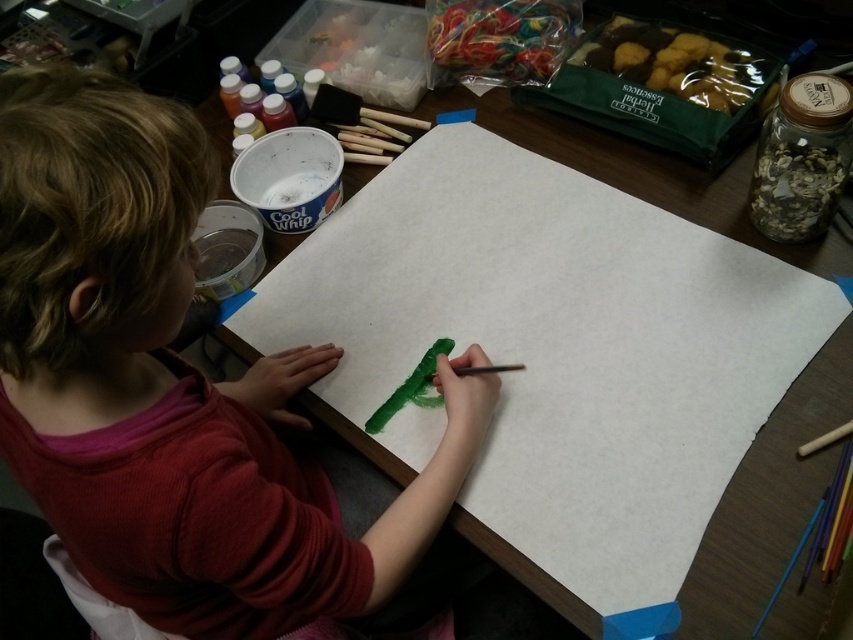
Question: Does multicolored plastic paintbrush at lower right appear on the left side of green matte paint brush at center?

Choices:
 (A) yes
 (B) no

Answer: (B)

Question: Does white paper at center appear on the left side of multicolored plastic paintbrush at lower right?

Choices:
 (A) yes
 (B) no

Answer: (A)

Question: Which is nearer to the green matte paint brush at center?

Choices:
 (A) white paper at center
 (B) smooth red shirt at center
 (C) multicolored plastic paintbrush at lower right

Answer: (A)

Question: Is multicolored plastic paintbrush at lower right behind green matte paint brush at center?

Choices:
 (A) yes
 (B) no

Answer: (B)

Question: Which point appears farthest from the camera in this image?

Choices:
 (A) (122, 544)
 (B) (664, 317)
 (C) (773, 589)

Answer: (B)

Question: Among these points, which one is nearest to the camera?

Choices:
 (A) (102, 122)
 (B) (808, 525)

Answer: (A)